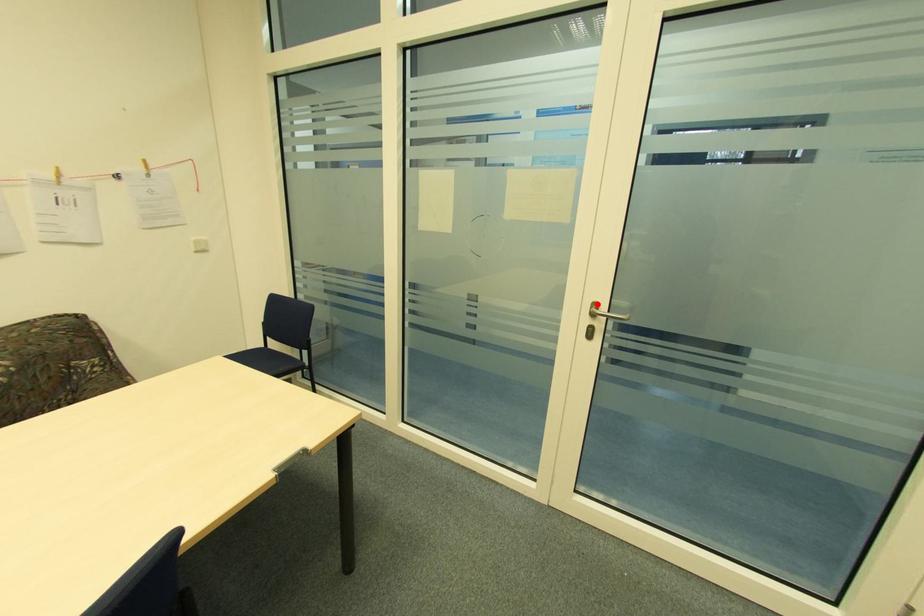
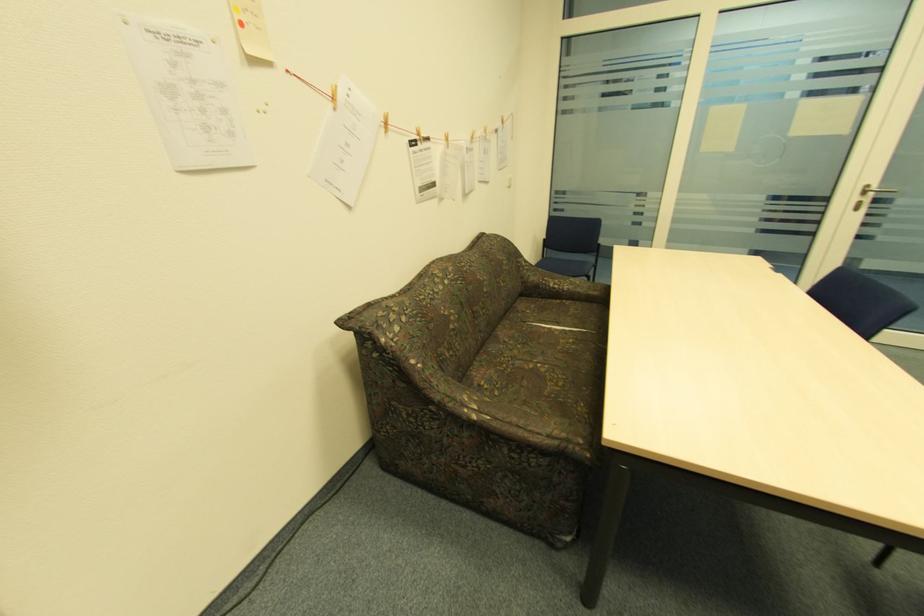
Question: I am providing you with two images of the same scene from different viewpoints. In image1, a red point is highlighted. Considering the same 3D point in image2, which of the following is correct?

Choices:
 (A) It is closer
 (B) It is farther

Answer: (B)